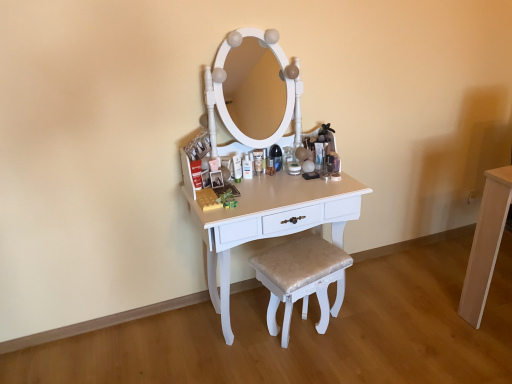
Where is `free space to the right of white glossy table at center, the 2th table in the right-to-left sequence`? This screenshot has height=384, width=512. free space to the right of white glossy table at center, the 2th table in the right-to-left sequence is located at coordinates (398, 314).